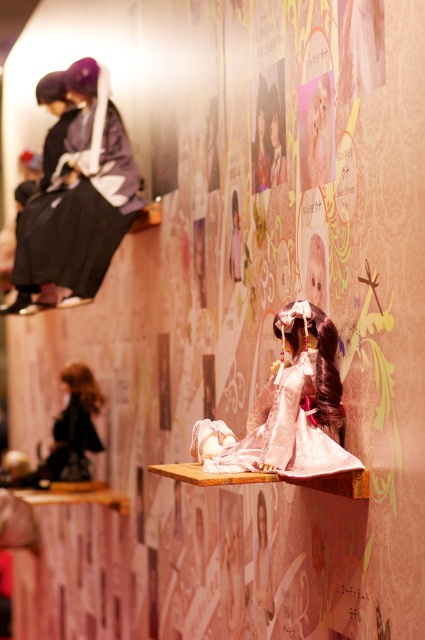
Question: Which object appears farthest from the camera in this image?

Choices:
 (A) satin pink dress at center
 (B) matte black kimono at upper left

Answer: (B)

Question: Which of the following is the closest to the observer?

Choices:
 (A) satin pink dress at center
 (B) matte black kimono at upper left

Answer: (A)

Question: Can you confirm if matte black kimono at upper left is bigger than satin pink dress at center?

Choices:
 (A) no
 (B) yes

Answer: (B)

Question: Is matte black kimono at upper left positioned before satin pink dress at center?

Choices:
 (A) no
 (B) yes

Answer: (A)

Question: Does matte black kimono at upper left come in front of satin pink dress at center?

Choices:
 (A) yes
 (B) no

Answer: (B)